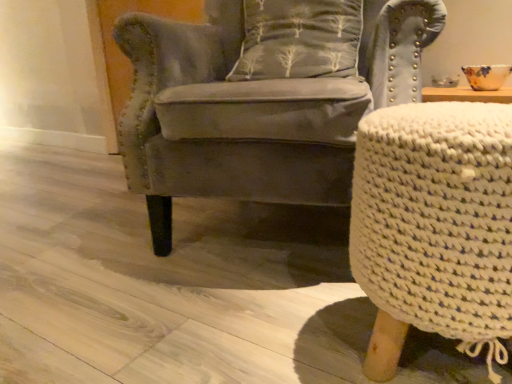
Question: Does point (504, 284) appear closer or farther from the camera than point (345, 54)?

Choices:
 (A) farther
 (B) closer

Answer: (B)

Question: Based on their positions, is white knitted stool at right located to the left or right of gray fabric pillow with tree pattern at center?

Choices:
 (A) right
 (B) left

Answer: (A)

Question: Which object is the closest to the white knitted stool at right?

Choices:
 (A) gray fabric pillow with tree pattern at center
 (B) velvet gray armchair at center

Answer: (B)

Question: Considering the real-world distances, which object is farthest from the gray fabric pillow with tree pattern at center?

Choices:
 (A) velvet gray armchair at center
 (B) white knitted stool at right

Answer: (B)